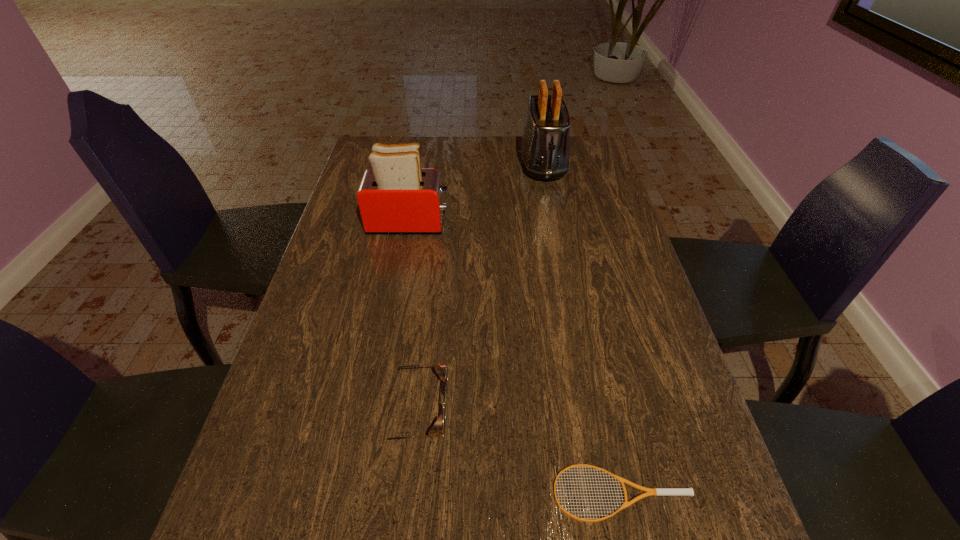
What are the coordinates of `free space located 0.200m on the front lenses of the third tallest object` in the screenshot? It's located at (548, 411).

What are the coordinates of `free space located on the back of the nearest object` in the screenshot? It's located at (582, 308).

Identify the location of object present at the far edge. This screenshot has height=540, width=960. (545, 146).

Find the location of `object situated at the left edge`. object situated at the left edge is located at coordinates (396, 196).

Find the location of a particular element. The image size is (960, 540). toaster at the right edge is located at coordinates (545, 146).

You are a GUI agent. You are given a task and a screenshot of the screen. Output one action in this format:
    pyautogui.click(x=<x>, y=<y>)
    Task: Click on the tennis racket located at the right edge
    The height and width of the screenshot is (540, 960).
    Given the screenshot: What is the action you would take?
    pyautogui.click(x=648, y=491)

Where is `object at the far right corner`? The width and height of the screenshot is (960, 540). object at the far right corner is located at coordinates (545, 146).

In the image, there is a desktop. In order to click on vacant space at the far edge in this screenshot , I will do `click(452, 157)`.

The height and width of the screenshot is (540, 960). Identify the location of vacant region at the left edge of the desktop. (297, 402).

At what (x,y) coordinates should I click in order to perform the action: click on vacant region at the right edge of the desktop. Please return your answer as a coordinate pair (x, y). This screenshot has width=960, height=540. Looking at the image, I should click on (660, 318).